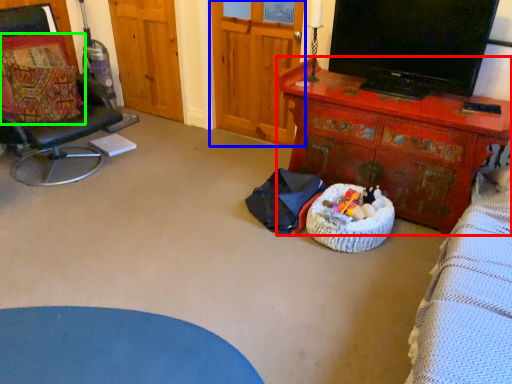
Question: Which object is positioned closest to desk (highlighted by a red box)? Select from armoire (highlighted by a blue box) and pillow (highlighted by a green box).

Choices:
 (A) armoire
 (B) pillow

Answer: (A)